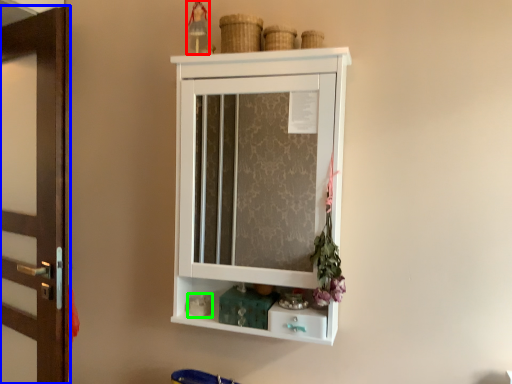
Question: Considering the real-world distances, which object is closest to toy (highlighted by a red box)? door (highlighted by a blue box) or toy (highlighted by a green box).

Choices:
 (A) door
 (B) toy

Answer: (A)